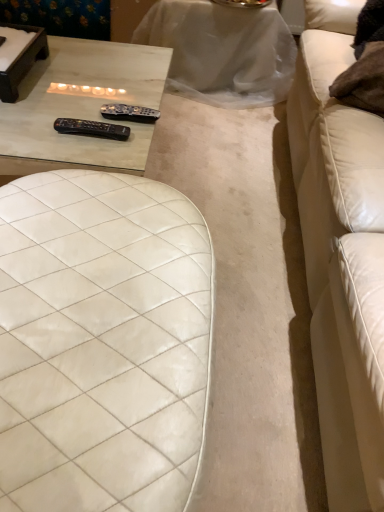
Question: Would you say black plastic remote at upper center, acting as the 2th remote starting from the front, is part of white marble table at upper center, positioned as the second table in bottom-to-top order,'s contents?

Choices:
 (A) yes
 (B) no

Answer: (B)

Question: Considering the relative sizes of white marble table at upper center, positioned as the second table in bottom-to-top order, and black plastic remote at upper center, marked as the first remote in a back-to-front arrangement, in the image provided, is white marble table at upper center, positioned as the second table in bottom-to-top order, bigger than black plastic remote at upper center, marked as the first remote in a back-to-front arrangement,?

Choices:
 (A) no
 (B) yes

Answer: (B)

Question: Can you confirm if white marble table at upper center, which ranks as the second table in front-to-back order, is smaller than black plastic remote at upper center, marked as the first remote in a back-to-front arrangement?

Choices:
 (A) yes
 (B) no

Answer: (B)

Question: Is white marble table at upper center, placed as the 1th table when sorted from back to front, shorter than black plastic remote at upper center, acting as the 2th remote starting from the front?

Choices:
 (A) yes
 (B) no

Answer: (B)

Question: Does white marble table at upper center, which ranks as the second table in front-to-back order, have a greater width compared to black plastic remote at upper center, marked as the first remote in a back-to-front arrangement?

Choices:
 (A) no
 (B) yes

Answer: (B)

Question: From a real-world perspective, is matte glass table at upper left, which ranks as the first table in bottom-to-top order, above or below black plastic remote at upper center, acting as the 2th remote starting from the front?

Choices:
 (A) above
 (B) below

Answer: (B)

Question: Would you say matte glass table at upper left, which is counted as the second table, starting from the top, is inside or outside black plastic remote at upper center, acting as the 2th remote starting from the front?

Choices:
 (A) inside
 (B) outside

Answer: (B)

Question: In terms of width, does matte glass table at upper left, which is counted as the second table, starting from the top, look wider or thinner when compared to black plastic remote at upper center, acting as the 2th remote starting from the front?

Choices:
 (A) wide
 (B) thin

Answer: (A)

Question: In the image, is matte glass table at upper left, which ranks as the first table in bottom-to-top order, positioned in front of or behind black plastic remote at upper center, marked as the first remote in a back-to-front arrangement?

Choices:
 (A) front
 (B) behind

Answer: (A)

Question: Is white marble table at upper center, placed as the 1th table when sorted from top to bottom, inside or outside of white quilted leather ottoman at center?

Choices:
 (A) outside
 (B) inside

Answer: (A)

Question: Based on their sizes in the image, would you say white marble table at upper center, which ranks as the second table in front-to-back order, is bigger or smaller than white quilted leather ottoman at center?

Choices:
 (A) big
 (B) small

Answer: (A)

Question: From the image's perspective, is white marble table at upper center, placed as the 1th table when sorted from top to bottom, positioned above or below white quilted leather ottoman at center?

Choices:
 (A) below
 (B) above

Answer: (B)

Question: Is point (244, 24) positioned closer to the camera than point (81, 202)?

Choices:
 (A) closer
 (B) farther

Answer: (B)

Question: In terms of height, does white leather couch at right look taller or shorter compared to matte glass table at upper left, which ranks as the first table in bottom-to-top order?

Choices:
 (A) short
 (B) tall

Answer: (B)

Question: Considering the positions of point (367, 232) and point (92, 55), is point (367, 232) closer or farther from the camera than point (92, 55)?

Choices:
 (A) closer
 (B) farther

Answer: (A)